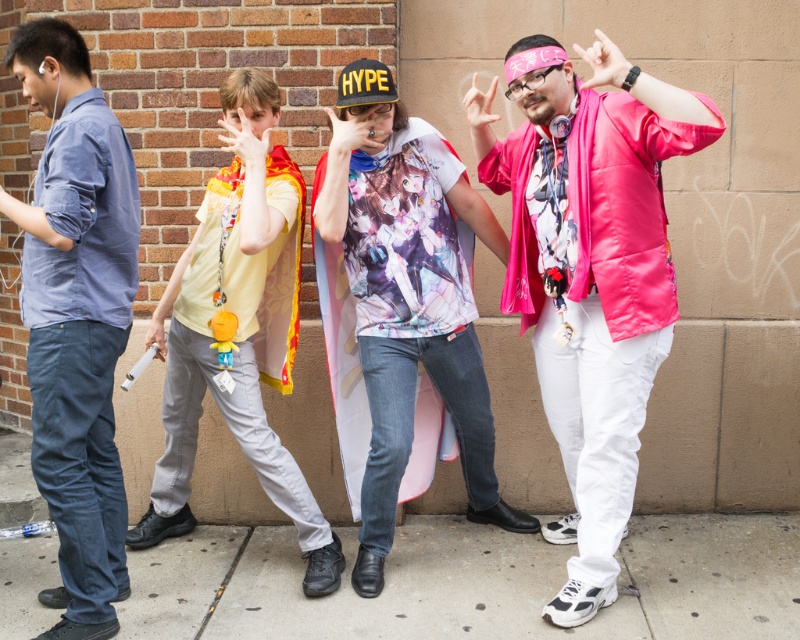
Question: Which point appears closest to the camera in this image?

Choices:
 (A) (646, 220)
 (B) (288, 616)

Answer: (A)

Question: Is shiny pink jacket at center wider than concrete at lower center?

Choices:
 (A) yes
 (B) no

Answer: (B)

Question: Is concrete at lower center wider than blue denim jeans at left?

Choices:
 (A) no
 (B) yes

Answer: (B)

Question: Among these points, which one is nearest to the camera?

Choices:
 (A) (594, 317)
 (B) (90, 428)

Answer: (A)

Question: Which point is farther from the camera taking this photo?

Choices:
 (A) (296, 211)
 (B) (56, 152)
 (C) (314, 244)

Answer: (C)

Question: Does concrete at lower center have a smaller size compared to printed fabric shirt at center?

Choices:
 (A) no
 (B) yes

Answer: (A)